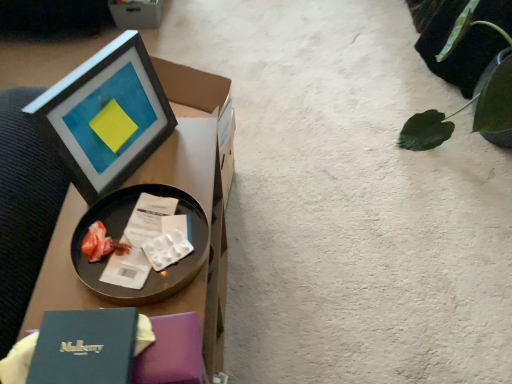
Question: From the image's perspective, is metallic tray at left over cardboard box at upper left?

Choices:
 (A) no
 (B) yes

Answer: (A)

Question: Is metallic tray at left surrounding cardboard box at upper left?

Choices:
 (A) no
 (B) yes

Answer: (A)

Question: Is metallic tray at left facing towards cardboard box at upper left?

Choices:
 (A) no
 (B) yes

Answer: (A)

Question: Considering the relative sizes of metallic tray at left and cardboard box at upper left in the image provided, is metallic tray at left thinner than cardboard box at upper left?

Choices:
 (A) no
 (B) yes

Answer: (A)

Question: Does metallic tray at left appear on the right side of cardboard box at upper left?

Choices:
 (A) yes
 (B) no

Answer: (A)

Question: Is metallic tray at left positioned beyond the bounds of cardboard box at upper left?

Choices:
 (A) no
 (B) yes

Answer: (B)

Question: From the image's perspective, does metallic tray at left appear higher than black glossy tray at upper left?

Choices:
 (A) yes
 (B) no

Answer: (A)

Question: Can you confirm if metallic tray at left is positioned to the left of black glossy tray at upper left?

Choices:
 (A) no
 (B) yes

Answer: (A)

Question: Would you say black glossy tray at upper left is part of metallic tray at left's contents?

Choices:
 (A) yes
 (B) no

Answer: (B)

Question: Is metallic tray at left wider than black glossy tray at upper left?

Choices:
 (A) yes
 (B) no

Answer: (B)

Question: Does metallic tray at left have a lesser height compared to black glossy tray at upper left?

Choices:
 (A) yes
 (B) no

Answer: (A)

Question: Considering the relative sizes of metallic tray at left and black glossy tray at upper left in the image provided, is metallic tray at left smaller than black glossy tray at upper left?

Choices:
 (A) no
 (B) yes

Answer: (B)

Question: From a real-world perspective, is cardboard box at upper left located higher than green leafy plant at upper right?

Choices:
 (A) no
 (B) yes

Answer: (A)